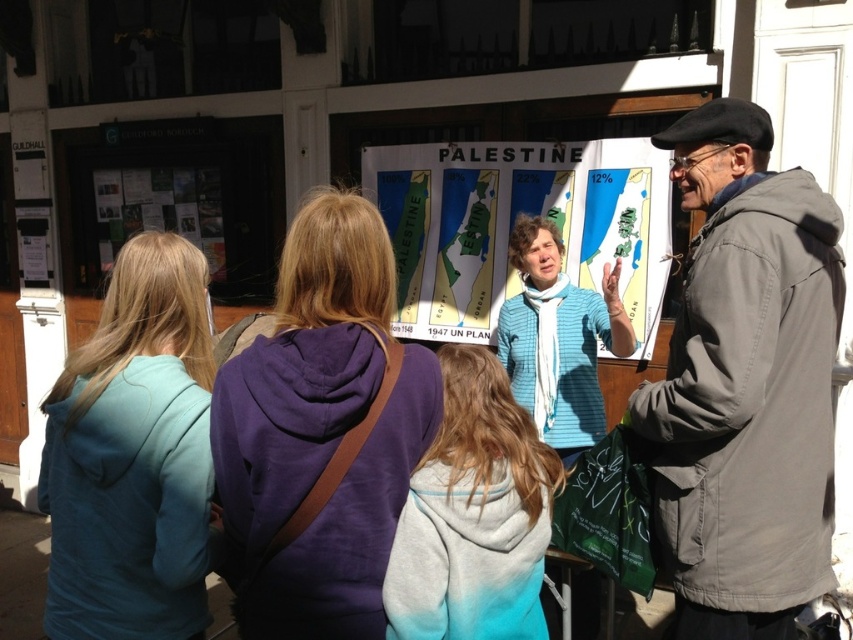
You are standing at the point labeled as point (222, 440). You want to walk directly towards the door located in the background. Is there any object between you and the door that might block your path?

The door is located in the background, and there are four individuals facing towards the large informational poster between you and the door. Since you are at point (222, 440), your path towards the door would be obstructed by these individuals.